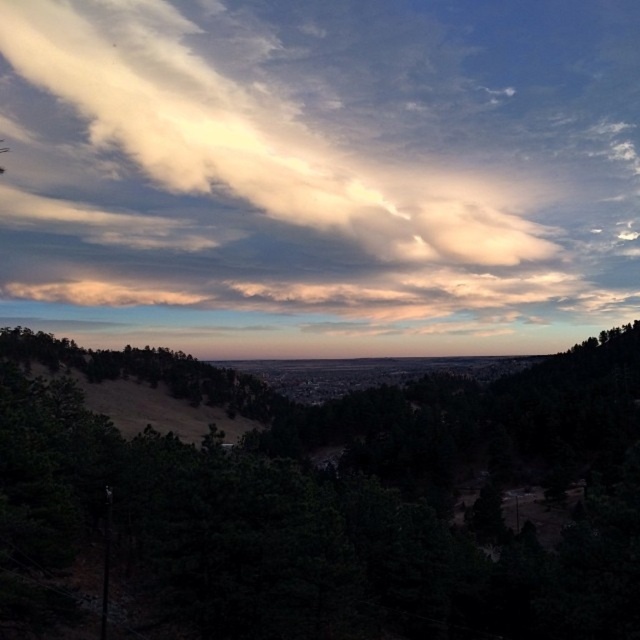
You are an artist painting the landscape and want to ensure the white fluffy cloud at upper center and the dark green leafy tree at center are proportionally accurate. Which object should you make wider in your painting?

The white fluffy cloud at upper center should be made wider in the painting since its width is larger than the dark green leafy tree at center.

You are standing in the landscape scene and want to look at the white fluffy cloud at upper center and the dark green leafy tree at center. Which object is positioned to the left when viewed from your perspective?

The white fluffy cloud at upper center is positioned to the left of the dark green leafy tree at center.